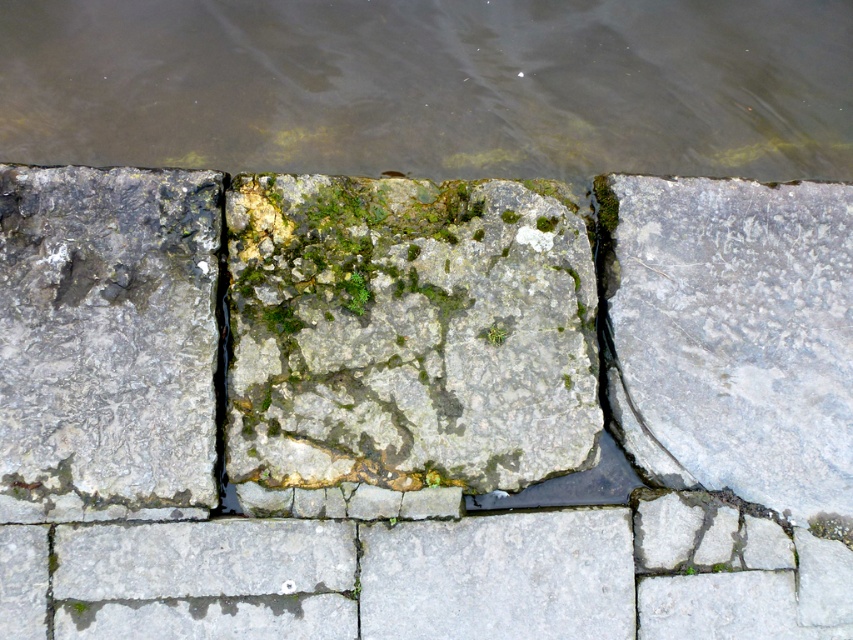
Question: From the image, what is the correct spatial relationship of gray rough stone at center in relation to gray stone at left?

Choices:
 (A) above
 (B) below

Answer: (A)

Question: Which point is closer to the camera?

Choices:
 (A) brown murky water at upper center
 (B) gray stone at center
 (C) gray rough stone at right

Answer: (B)

Question: Estimate the real-world distances between objects in this image. Which object is closer to the gray rough stone at center?

Choices:
 (A) gray stone at center
 (B) gray stone at left

Answer: (A)

Question: Observing the image, what is the correct spatial positioning of brown murky water at upper center in reference to gray rough stone at center?

Choices:
 (A) right
 (B) left

Answer: (A)

Question: Based on their relative distances, which object is farther from the brown murky water at upper center?

Choices:
 (A) gray rough stone at right
 (B) gray stone at center

Answer: (A)

Question: Does brown murky water at upper center have a lesser width compared to gray rough stone at right?

Choices:
 (A) no
 (B) yes

Answer: (A)